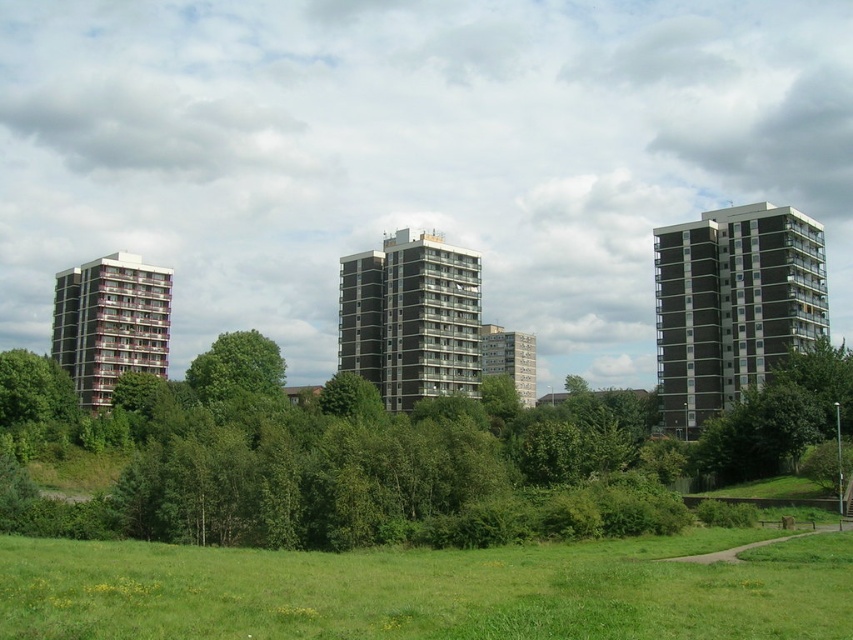
Looking at this image, you are standing at the viewpoint of the image and want to walk towards the two points marked in the scene. Which point would you reach first, point (689, 372) or point (523, 364)?

Point (689, 372) is closer to the viewer than point (523, 364), so you would reach point (689, 372) first.

You are a drone operator who needs to deliver a package to both the brown brick building at right and the gray concrete building at center. Which building should you approach first to ensure you can see both buildings clearly from your current position?

You should approach the brown brick building at right first because it is closer to the viewer than the gray concrete building at center, allowing you to maintain visibility of both while navigating.